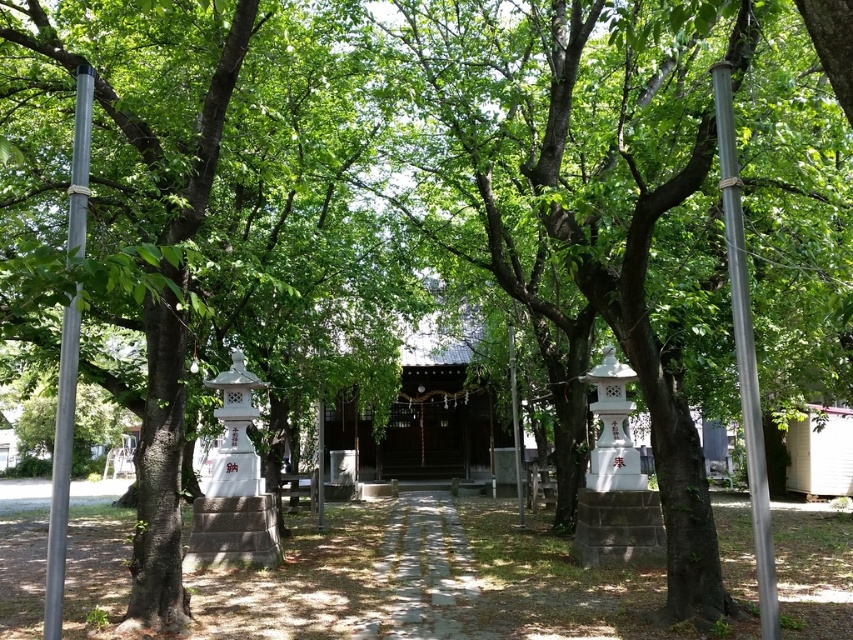
Question: Which point is closer to the camera taking this photo?

Choices:
 (A) (740, 362)
 (B) (61, 602)

Answer: (B)

Question: Where is metallic gray pole at right located in relation to metallic pole at center in the image?

Choices:
 (A) right
 (B) left

Answer: (A)

Question: Is metallic gray pole at right above silver metallic pole at left?

Choices:
 (A) no
 (B) yes

Answer: (B)

Question: Which object is positioned farthest from the metallic gray pole at right?

Choices:
 (A) metallic pole at center
 (B) silver metallic pole at left

Answer: (A)

Question: Is metallic gray pole at right above metallic pole at center?

Choices:
 (A) yes
 (B) no

Answer: (A)

Question: Which point is closer to the camera?

Choices:
 (A) metallic gray pole at right
 (B) metallic pole at center
 (C) silver metallic pole at left

Answer: (C)